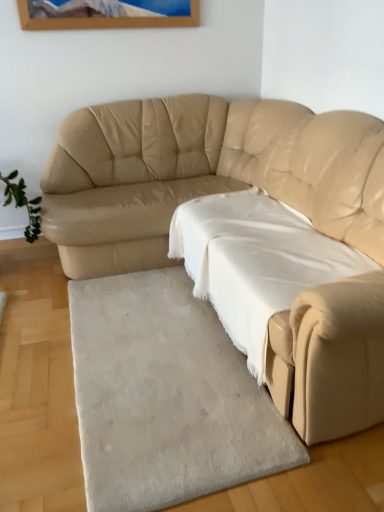
Question: Is white cotton sheet at center inside the boundaries of white soft rug at lower center, or outside?

Choices:
 (A) inside
 (B) outside

Answer: (B)

Question: Looking at the image, does white cotton sheet at center seem bigger or smaller compared to white soft rug at lower center?

Choices:
 (A) big
 (B) small

Answer: (A)

Question: Which of these objects is positioned farthest from the beige leather couch at center?

Choices:
 (A) white cotton sheet at center
 (B) white soft rug at lower center

Answer: (B)

Question: Which of these objects is positioned farthest from the white soft rug at lower center?

Choices:
 (A) beige leather couch at center
 (B) white cotton sheet at center

Answer: (A)